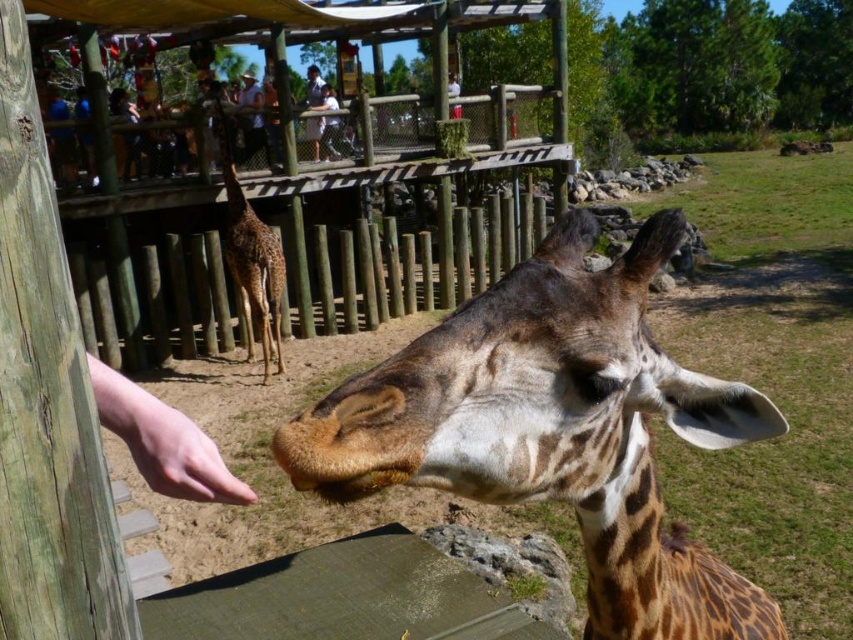
You are a zookeeper who needs to place a new feeding station between the spotted fur giraffe at center and the spotted brown giraffe at center. The feeding station requires a minimum of 5 meters of space to function properly. Can the feeding station be placed between them?

The spotted fur giraffe at center and spotted brown giraffe at center are 6.81 meters apart from each other. Since the required space is 5 meters, the feeding station can be placed between them as the distance is sufficient.

You are a zoo visitor standing in front of the giraffe enclosure. You want to take a photo of the spotted fur giraffe at center and the spotted brown giraffe at center. Which one should you focus on first to ensure both are in the frame?

You should focus on the spotted fur giraffe at center first because it is closer to you than the spotted brown giraffe at center, so adjusting the camera to include both would require starting with the closer one.